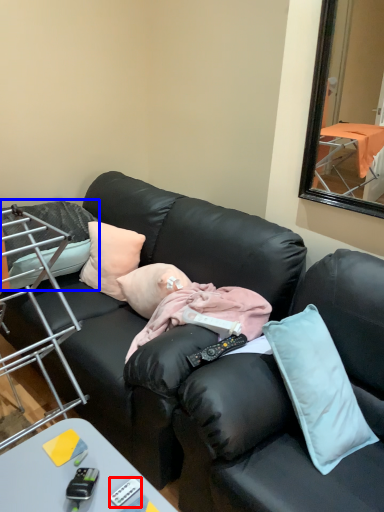
Question: Which object appears closest to the camera in this image, remote control (highlighted by a red box) or pillow (highlighted by a blue box)?

Choices:
 (A) remote control
 (B) pillow

Answer: (A)